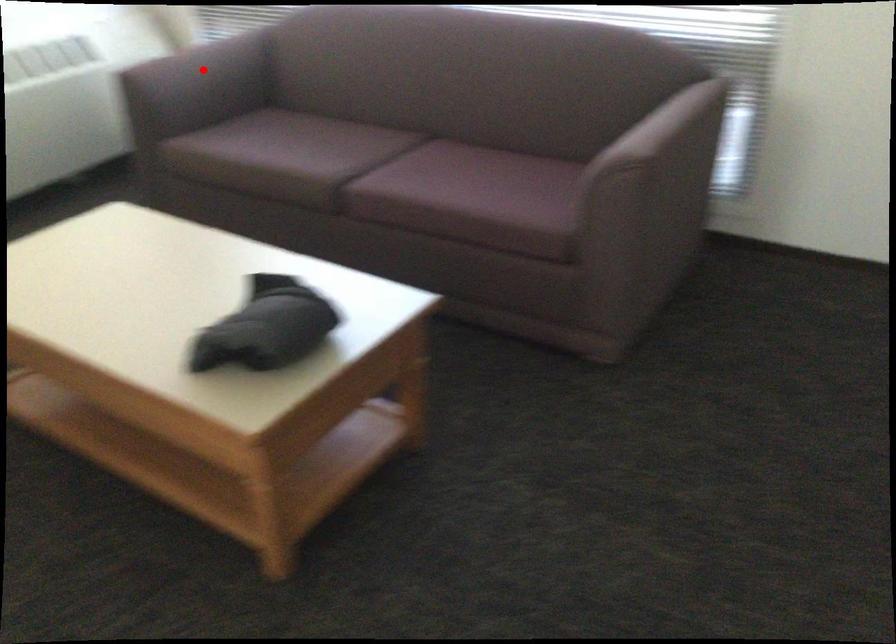
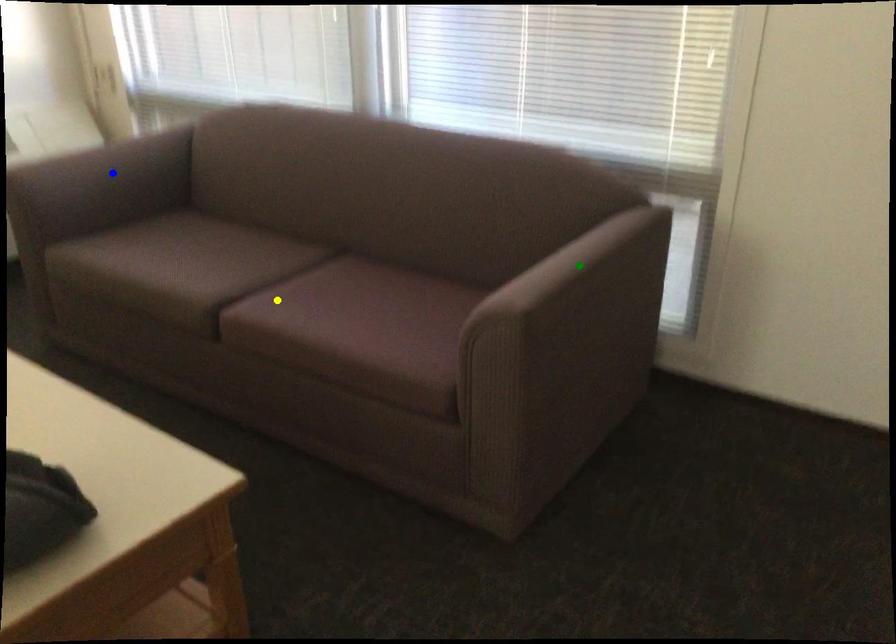
Question: I am providing you with two images of the same scene from different viewpoints. A red point is marked on the first image. You are given multiple points on the second image. Which point in image 2 represents the same 3d spot as the red point in image 1?

Choices:
 (A) blue point
 (B) yellow point
 (C) green point

Answer: (A)